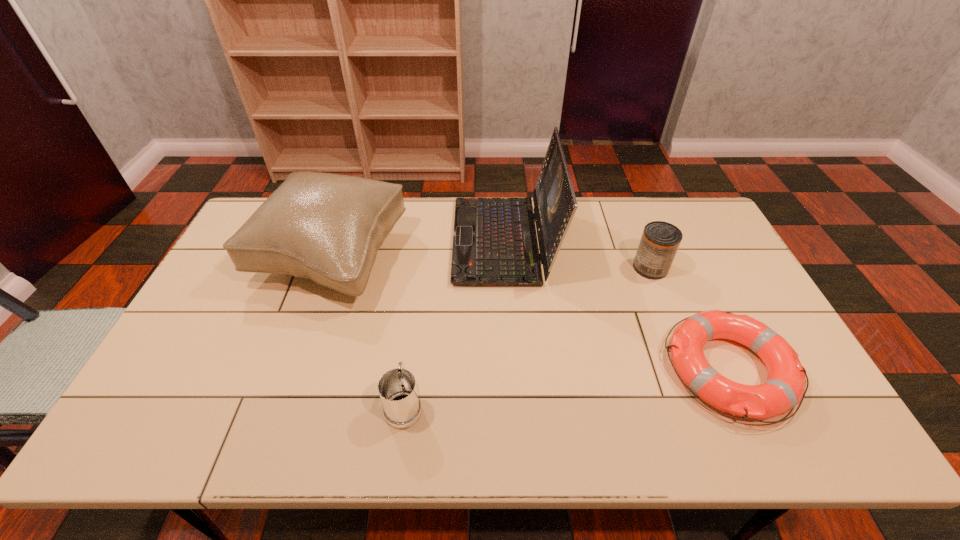
Find the location of a particular element. This screenshot has height=540, width=960. free location located 0.060m on the back of the leftmost object is located at coordinates (351, 204).

Where is `free point located on the left of the third shortest object`? Image resolution: width=960 pixels, height=540 pixels. free point located on the left of the third shortest object is located at coordinates (617, 267).

Identify the location of free space located on the side of the fourth tallest object with the handle. Image resolution: width=960 pixels, height=540 pixels. (413, 342).

In order to click on vacant point located 0.070m on the side of the fourth tallest object with the handle in this screenshot , I will do coord(410,358).

Locate an element on the screen. This screenshot has height=540, width=960. vacant space located on the side of the fourth tallest object with the handle is located at coordinates (411, 352).

Image resolution: width=960 pixels, height=540 pixels. What are the coordinates of `vacant space located 0.360m on the left of the life buoy` in the screenshot? It's located at tap(524, 369).

The image size is (960, 540). I want to click on laptop computer positioned at the far edge, so (495, 243).

This screenshot has width=960, height=540. Identify the location of cushion situated at the far edge. (326, 227).

Find the location of `mug that is positioned at the near edge`. mug that is positioned at the near edge is located at coordinates (397, 388).

What are the coordinates of `life buoy at the near edge` in the screenshot? It's located at (784, 388).